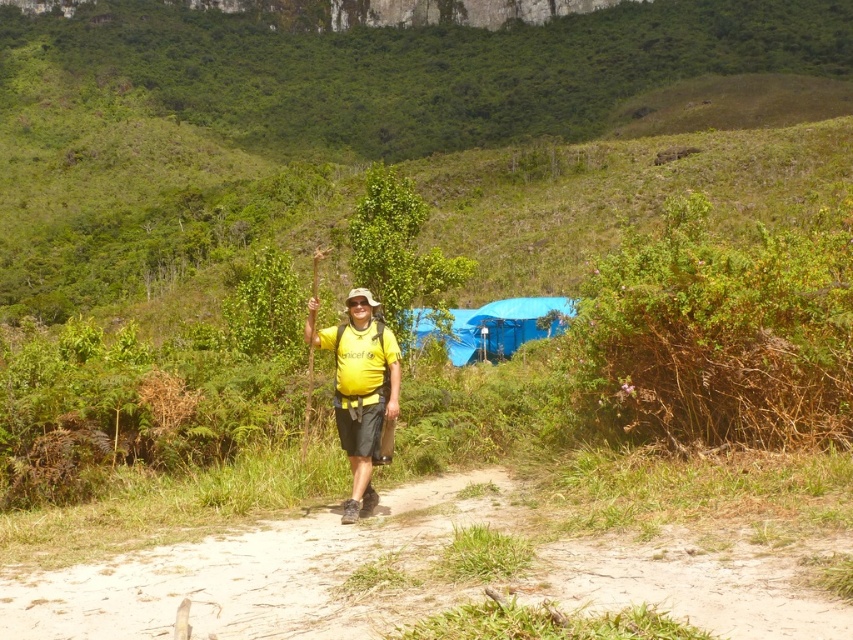
Question: Observing the image, what is the correct spatial positioning of dirt path at center in reference to yellow matte shirt at center?

Choices:
 (A) left
 (B) right

Answer: (B)

Question: Which of the following is the farthest from the observer?

Choices:
 (A) (395, 412)
 (B) (741, 259)
 (C) (830, 600)

Answer: (A)

Question: Among these points, which one is farthest from the camera?

Choices:
 (A) (747, 387)
 (B) (628, 593)
 (C) (368, 490)

Answer: (C)

Question: Is dirt path at center bigger than yellow matte shirt at center?

Choices:
 (A) no
 (B) yes

Answer: (B)

Question: Is dirt path at center to the right of green leafy bush at right from the viewer's perspective?

Choices:
 (A) no
 (B) yes

Answer: (A)

Question: Which object is positioned closest to the yellow matte shirt at center?

Choices:
 (A) dirt path at center
 (B) green leafy bush at right

Answer: (A)